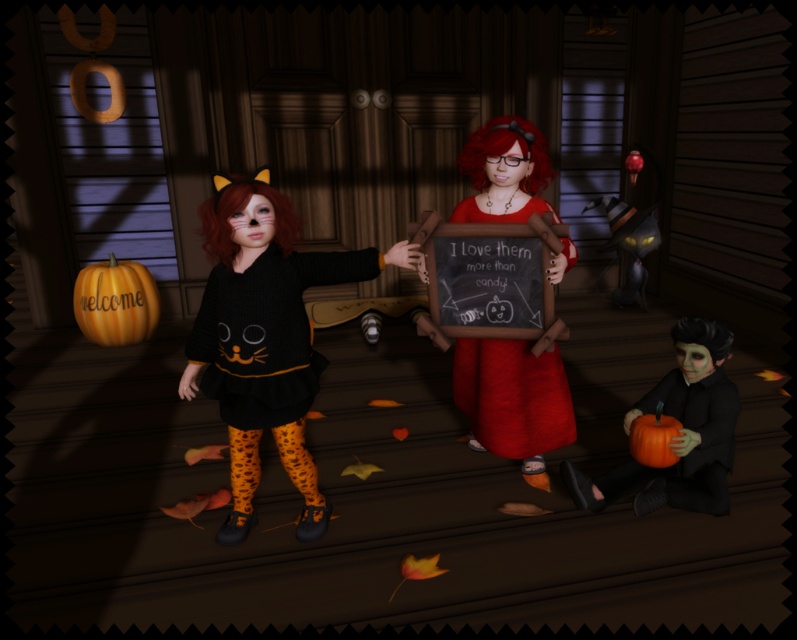
You are a parent trying to take a photo of your child and the Halloween decorations. You want to ensure both the black knit dress at center and the matte black pumpkin at lower right are visible in the frame. Which object will appear larger in the photo?

The black knit dress at center will appear larger in the photo because it is taller than the matte black pumpkin at lower right.

You are a costume designer observing the Halloween scene. You need to determine which object is bigger between the black knit dress at center and the matte black pumpkin at lower right. Based on the scene, which one is larger?

The black knit dress at center is larger in size than the matte black pumpkin at lower right.